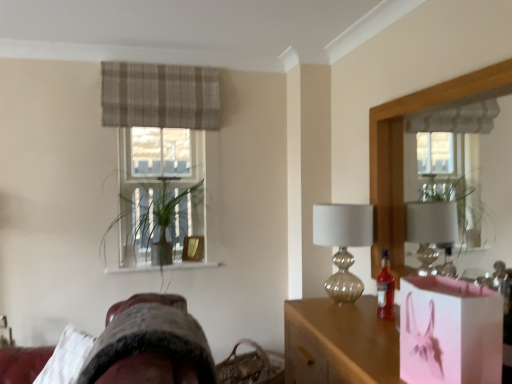
Question: Does pink paper bag at lower right have a lesser width compared to translucent glass bottle at right?

Choices:
 (A) no
 (B) yes

Answer: (A)

Question: Can you confirm if pink paper bag at lower right is bigger than translucent glass bottle at right?

Choices:
 (A) no
 (B) yes

Answer: (B)

Question: Is pink paper bag at lower right surrounding translucent glass bottle at right?

Choices:
 (A) no
 (B) yes

Answer: (A)

Question: Is pink paper bag at lower right turned away from translucent glass bottle at right?

Choices:
 (A) no
 (B) yes

Answer: (A)

Question: Is the depth of pink paper bag at lower right greater than that of translucent glass bottle at right?

Choices:
 (A) yes
 (B) no

Answer: (B)

Question: From a real-world perspective, is pink paper bag at lower right below translucent glass bottle at right?

Choices:
 (A) yes
 (B) no

Answer: (B)

Question: Is translucent glass bottle at right at the left side of wooden frame mirror at right?

Choices:
 (A) no
 (B) yes

Answer: (B)

Question: Considering the relative sizes of translucent glass bottle at right and wooden frame mirror at right in the image provided, is translucent glass bottle at right bigger than wooden frame mirror at right?

Choices:
 (A) no
 (B) yes

Answer: (A)

Question: Considering the relative sizes of translucent glass bottle at right and wooden frame mirror at right in the image provided, is translucent glass bottle at right thinner than wooden frame mirror at right?

Choices:
 (A) no
 (B) yes

Answer: (B)

Question: From the image's perspective, is translucent glass bottle at right beneath wooden frame mirror at right?

Choices:
 (A) yes
 (B) no

Answer: (A)

Question: Considering the relative sizes of translucent glass bottle at right and wooden frame mirror at right in the image provided, is translucent glass bottle at right smaller than wooden frame mirror at right?

Choices:
 (A) no
 (B) yes

Answer: (B)

Question: Can you confirm if translucent glass bottle at right is taller than wooden frame mirror at right?

Choices:
 (A) yes
 (B) no

Answer: (B)

Question: Does green leafy plant at center have a greater height compared to translucent glass bottle at right?

Choices:
 (A) no
 (B) yes

Answer: (B)